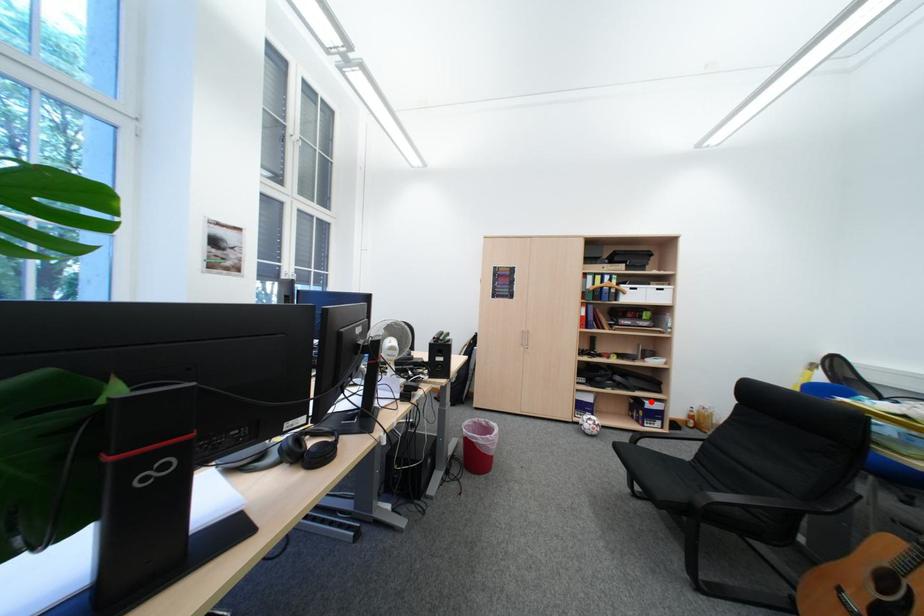
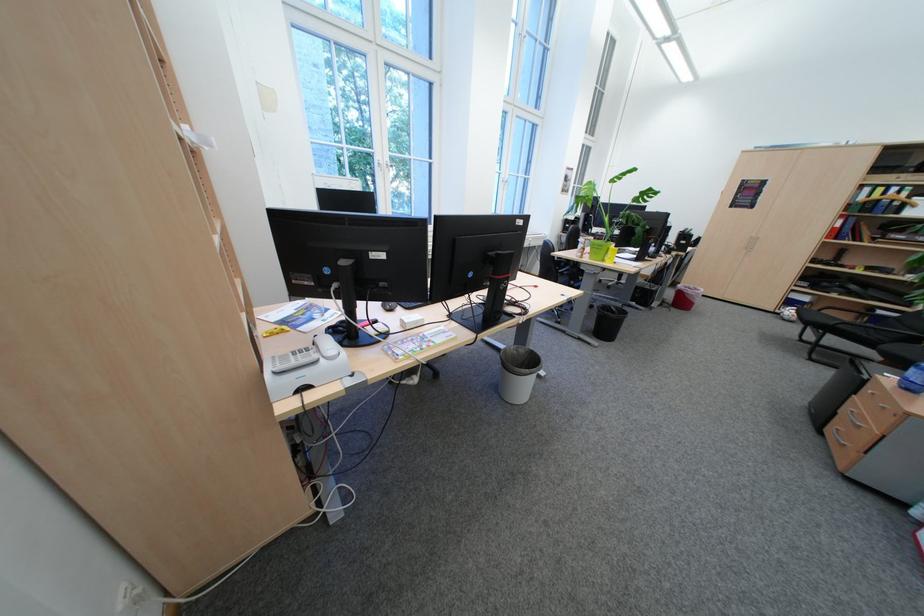
Locate, in the second image, the point that corresponds to the highlighted location in the first image.

(881, 310)